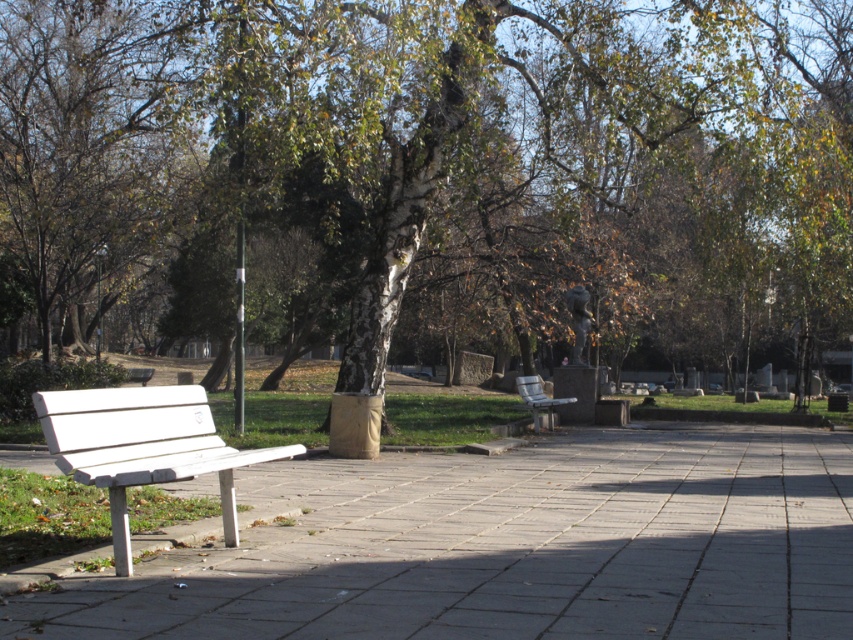
You are a delivery person trying to park your 2.5 meter long cart in the park. You see the white concrete pavement at center and the white plastic bench at lower left. Which area can accommodate your cart without overlapping the bench?

The white concrete pavement at center has a larger size compared to the white plastic bench at lower left, so the cart can be parked on the white concrete pavement at center without overlapping the bench.

You are standing at the entrance of the park and want to find the white bark tree at center. According to the coordinates provided, in which direction should you walk from your current position to reach it?

The white bark tree at center is located at coordinates point (440, 170). Since the coordinate system typically has (0, 0) at the bottom left corner, moving towards higher x values moves right and higher y values move up. Therefore, to reach the tree, you should walk towards the right and forward.